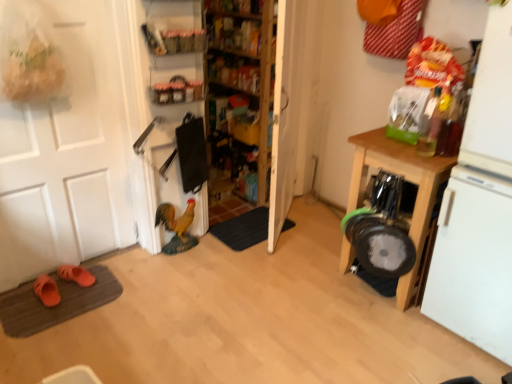
Locate an element on the screen. free spot in front of wooden shelves at center, which is the third shelf from front to back is located at coordinates (258, 265).